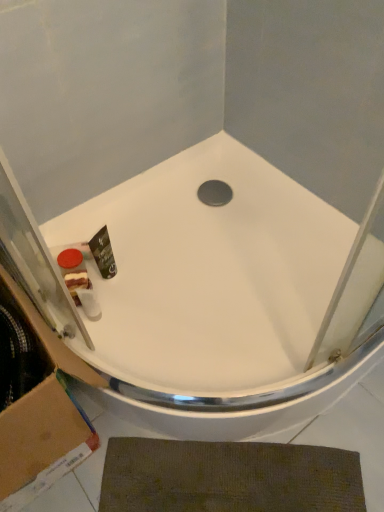
Question: From the image's perspective, is brown textured bath mat at lower center located above or below white glossy bathtub at center?

Choices:
 (A) above
 (B) below

Answer: (B)

Question: From a real-world perspective, is brown textured bath mat at lower center positioned above or below white glossy bathtub at center?

Choices:
 (A) below
 (B) above

Answer: (A)

Question: Estimate the real-world distances between objects in this image. Which object is closer to the brown textured bath mat at lower center?

Choices:
 (A) matte plastic soap at lower left
 (B) white glossy bathtub at center
 (C) brown cardboard at lower left

Answer: (C)

Question: Estimate the real-world distances between objects in this image. Which object is closer to the brown cardboard at lower left?

Choices:
 (A) matte plastic soap at lower left
 (B) white glossy bathtub at center
 (C) brown textured bath mat at lower center

Answer: (C)